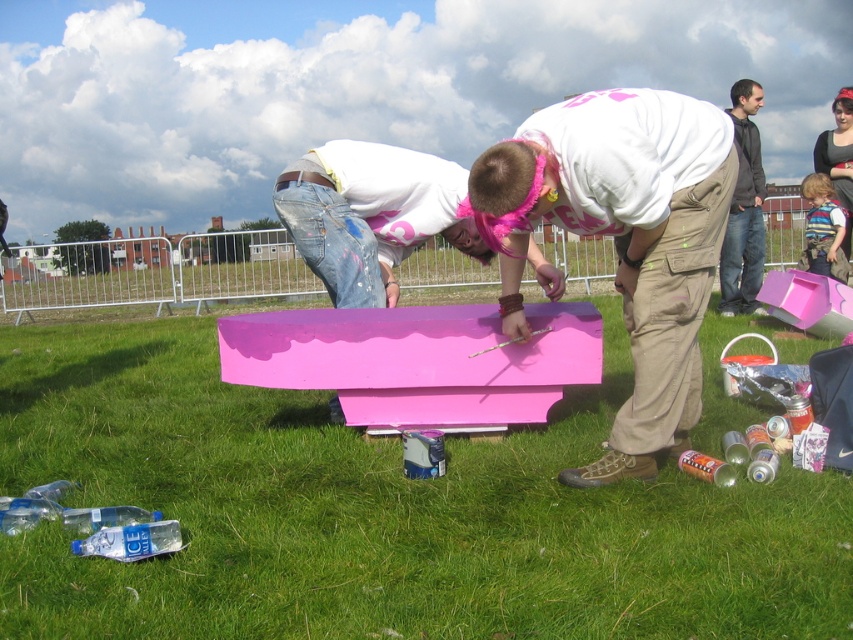
You are standing in the grassy field and want to pick up the striped sweater at lower right. Is the green grass at center blocking your path to it?

The green grass at center is in front of the striped sweater at lower right, so the grass is blocking the path to the sweater.

You are standing in the grassy field and see the green grass at center and the striped sweater at lower right. Which object is closer to your left side?

The green grass at center is closer to your left side as it is positioned to the left of the striped sweater at lower right.

You are standing in the grassy field and want to place a 1.5 meter wide box between the pink matte wood at center and the striped sweater at lower right. Can the space between them accommodate the box?

The pink matte wood at center is wider than the striped sweater at lower right. However, the description only provides information about their widths, not the distance between them. Without knowing the actual space between the two objects, it is impossible to determine if the 1.5 meter wide box can fit.